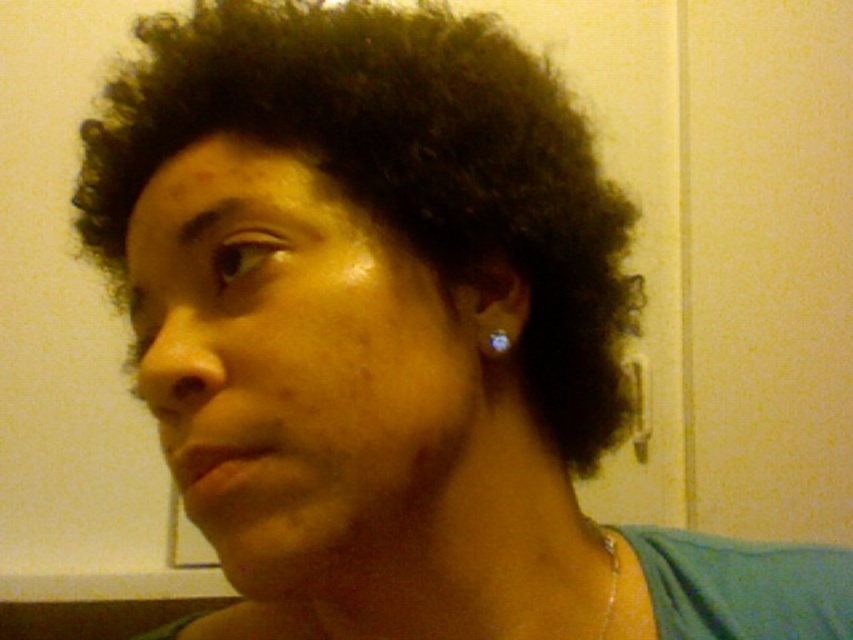
You are a photographer standing in front of the individual wearing a teal top. You want to capture a close portrait focusing on their face while ensuring the gold metallic necklace at lower center is still visible in the frame. Based on your current distance, will the necklace be in focus if you set your camera to a shallow depth of field?

The gold metallic necklace at lower center and viewer are 14.13 inches apart. With a shallow depth of field, the necklace may appear slightly out of focus if it is significantly farther from the camera than the main subject, but since the distance is only 14.13 inches, it might still be within the depth of field depending on the lens aperture. However, the exact focus depends on the camera settings and lens used.

From the picture: You are a photographer setting up for a portrait session. You need to ensure that the dark curly hair at center and the silver metallic earring at ear are both visible in the frame. Based on their positions, which object is closer to the left edge of the frame?

The dark curly hair at center is positioned on the left side of silver metallic earring at ear, so the dark curly hair at center is closer to the left edge of the frame.

You are taking a photo of a person and want to focus on two points on their face. The first point is at coordinate point (613, 564) and the second is at point (492, 344). Which point should you focus on first if you want to capture the closest point to the camera?

Point (613, 564) is further to the camera than point (492, 344), so you should focus on point (613, 564) first as it is closer to the camera.